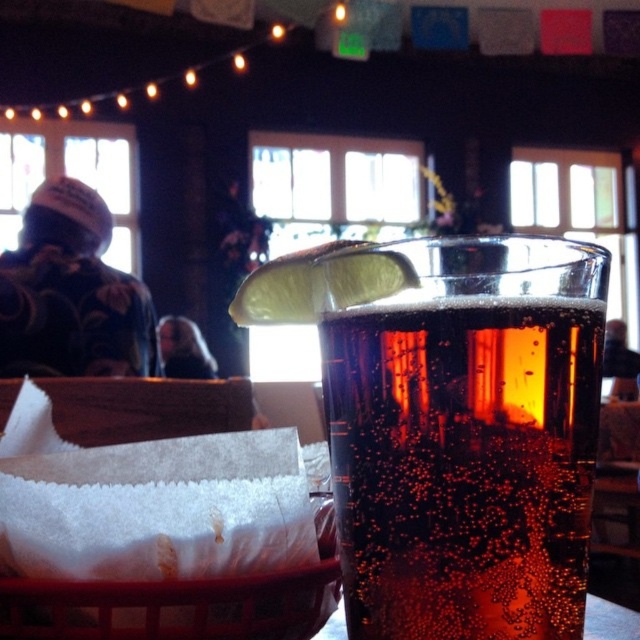
Question: Which of the following is the closest to the observer?

Choices:
 (A) (376, 570)
 (B) (618, 323)

Answer: (A)

Question: Which object appears closest to the camera in this image?

Choices:
 (A) flannel shirt at left
 (B) wooden basket at lower left
 (C) dark hair at center

Answer: (B)

Question: Which of the following is the closest to the observer?

Choices:
 (A) flannel shirt at left
 (B) matte black jacket at upper left
 (C) wooden basket at lower left
 (D) dark hair at center

Answer: (C)

Question: Is amber glass at upper center further to camera compared to flannel shirt at left?

Choices:
 (A) no
 (B) yes

Answer: (A)

Question: Can you confirm if flannel shirt at left is smaller than wooden basket at lower left?

Choices:
 (A) no
 (B) yes

Answer: (A)

Question: Where is amber glass at upper center located in relation to dark hair at center in the image?

Choices:
 (A) right
 (B) left

Answer: (A)